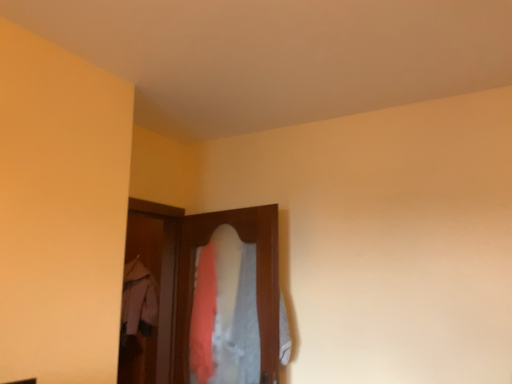
Question: From a real-world perspective, is light pink fabric coat at center under wooden screen door at center?

Choices:
 (A) no
 (B) yes

Answer: (B)

Question: Is light pink fabric coat at center to the right of wooden screen door at center from the viewer's perspective?

Choices:
 (A) yes
 (B) no

Answer: (B)

Question: Is wooden screen door at center at the back of light pink fabric coat at center?

Choices:
 (A) yes
 (B) no

Answer: (B)

Question: Is light pink fabric coat at center aimed at wooden screen door at center?

Choices:
 (A) no
 (B) yes

Answer: (A)

Question: Considering the relative sizes of light pink fabric coat at center and wooden screen door at center in the image provided, is light pink fabric coat at center bigger than wooden screen door at center?

Choices:
 (A) no
 (B) yes

Answer: (B)

Question: In terms of width, does wooden screen door at center look wider or thinner when compared to textured fabric closet at center?

Choices:
 (A) wide
 (B) thin

Answer: (A)

Question: From the image's perspective, is wooden screen door at center located above or below textured fabric closet at center?

Choices:
 (A) above
 (B) below

Answer: (B)

Question: In terms of height, does wooden screen door at center look taller or shorter compared to textured fabric closet at center?

Choices:
 (A) short
 (B) tall

Answer: (B)

Question: Do you think wooden screen door at center is within textured fabric closet at center, or outside of it?

Choices:
 (A) outside
 (B) inside

Answer: (A)

Question: Considering the positions of light pink fabric coat at center and wooden screen door at center in the image, is light pink fabric coat at center wider or thinner than wooden screen door at center?

Choices:
 (A) thin
 (B) wide

Answer: (B)

Question: Relative to wooden screen door at center, is light pink fabric coat at center in front or behind?

Choices:
 (A) front
 (B) behind

Answer: (B)

Question: From a real-world perspective, is light pink fabric coat at center physically located above or below wooden screen door at center?

Choices:
 (A) above
 (B) below

Answer: (B)

Question: Is point 135,301 positioned closer to the camera than point 143,246?

Choices:
 (A) farther
 (B) closer

Answer: (B)

Question: From their relative heights in the image, would you say wooden screen door at center is taller or shorter than light pink fabric coat at center?

Choices:
 (A) tall
 (B) short

Answer: (A)

Question: In the image, is wooden screen door at center on the left side or the right side of light pink fabric coat at center?

Choices:
 (A) left
 (B) right

Answer: (B)